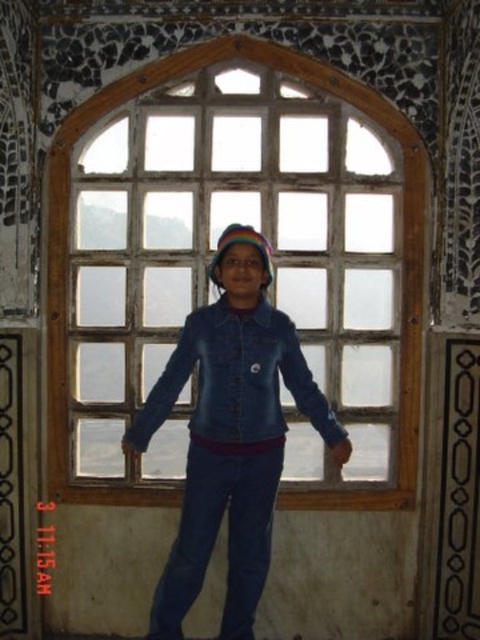
What do you see at coordinates (210, 252) in the screenshot? I see `wooden grid at center` at bounding box center [210, 252].

Can you confirm if wooden grid at center is thinner than denim jacket at center?

In fact, wooden grid at center might be wider than denim jacket at center.

Does point (143, 212) come behind point (223, 630)?

That is True.

Identify the location of wooden grid at center. This screenshot has width=480, height=640. (210, 252).